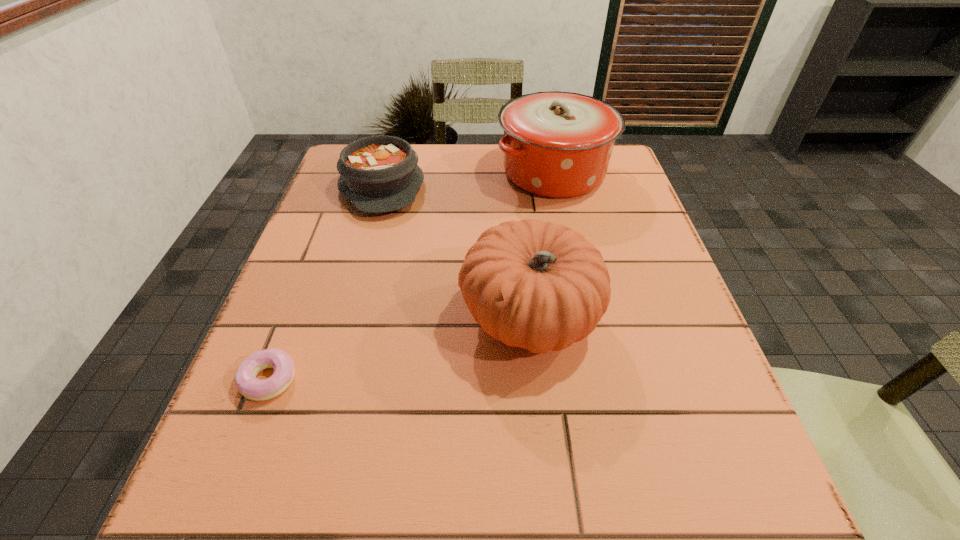
This screenshot has height=540, width=960. I want to click on the taller casserole, so click(556, 144).

Where is `pumpkin`? This screenshot has width=960, height=540. pumpkin is located at coordinates (541, 286).

You are a GUI agent. You are given a task and a screenshot of the screen. Output one action in this format:
    pyautogui.click(x=<x>, y=<y>)
    Task: Click on the left casserole
    
    Given the screenshot: What is the action you would take?
    pyautogui.click(x=378, y=174)

You are a GUI agent. You are given a task and a screenshot of the screen. Output one action in this format:
    pyautogui.click(x=<x>, y=<y>)
    Task: Click on the shorter casserole
    
    Given the screenshot: What is the action you would take?
    pyautogui.click(x=378, y=174)

Where is `the shortest object`? This screenshot has width=960, height=540. the shortest object is located at coordinates (247, 384).

Image resolution: width=960 pixels, height=540 pixels. Find the location of `vacant area situated 0.320m on the front of the right casserole`. vacant area situated 0.320m on the front of the right casserole is located at coordinates (584, 309).

At what (x,y) coordinates should I click in order to perform the action: click on vacant point located on the left of the pumpkin. Please return your answer as a coordinate pair (x, y). The image size is (960, 540). Looking at the image, I should click on (346, 318).

The image size is (960, 540). Find the location of `vacant position located on the right of the second shortest object`. vacant position located on the right of the second shortest object is located at coordinates (476, 186).

You are a GUI agent. You are given a task and a screenshot of the screen. Output one action in this format:
    pyautogui.click(x=<x>, y=<y>)
    Task: Click on the free spot located 0.170m on the front of the doughnut
    
    Given the screenshot: What is the action you would take?
    pyautogui.click(x=212, y=526)

Locate an element on the screen. casserole that is positioned at the left edge is located at coordinates (378, 174).